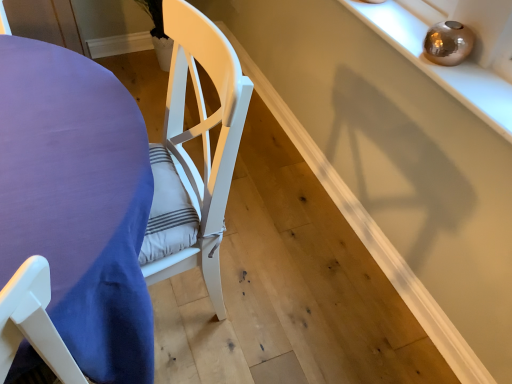
Identify the location of free space above shiny metallic orb at upper right (from a real-world perspective). This screenshot has height=384, width=512. (421, 48).